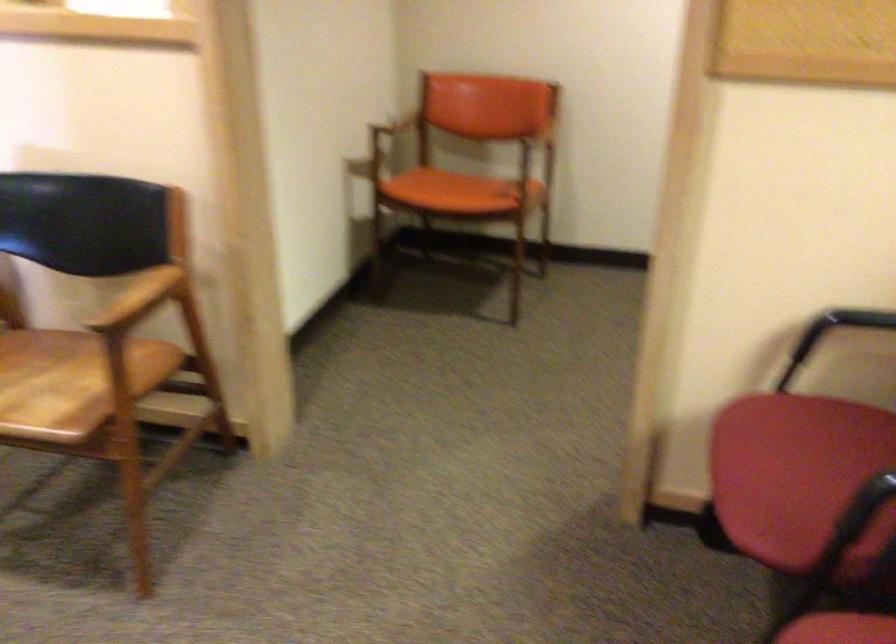
The width and height of the screenshot is (896, 644). I want to click on black chair armrest, so click(x=840, y=325).